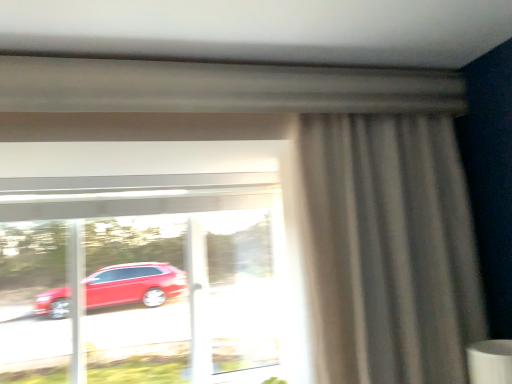
Describe the element at coordinates (390, 248) in the screenshot. I see `matte gray curtain at right` at that location.

Image resolution: width=512 pixels, height=384 pixels. I want to click on matte gray curtain at right, so click(x=390, y=248).

Image resolution: width=512 pixels, height=384 pixels. What do you see at coordinates (147, 264) in the screenshot?
I see `transparent glass window at center` at bounding box center [147, 264].

Find the location of a particular element. This screenshot has height=384, width=512. transparent glass window at center is located at coordinates (147, 264).

Image resolution: width=512 pixels, height=384 pixels. Find the location of `matte gray curtain at right`. matte gray curtain at right is located at coordinates (390, 248).

Considering the relative positions of transparent glass window at center and matte gray curtain at right in the image provided, is transparent glass window at center to the left or to the right of matte gray curtain at right?

Clearly, transparent glass window at center is on the left of matte gray curtain at right in the image.

In the image, is transparent glass window at center positioned in front of or behind matte gray curtain at right?

In the image, transparent glass window at center appears behind matte gray curtain at right.

Does point (170, 147) come behind point (443, 182)?

That is True.

From the image's perspective, which one is positioned lower, transparent glass window at center or matte gray curtain at right?

transparent glass window at center.

From a real-world perspective, which object stands above the other?

matte gray curtain at right is physically above.

Between transparent glass window at center and matte gray curtain at right, which one has larger width?

Wider between the two is matte gray curtain at right.

Does transparent glass window at center have a lesser height compared to matte gray curtain at right?

Yes.

From the picture: Considering the relative sizes of transparent glass window at center and matte gray curtain at right in the image provided, is transparent glass window at center smaller than matte gray curtain at right?

No.

Is transparent glass window at center located outside matte gray curtain at right?

Yes, transparent glass window at center is located beyond the bounds of matte gray curtain at right.

Is the surface of transparent glass window at center in direct contact with matte gray curtain at right?

No.

Does transparent glass window at center turn towards matte gray curtain at right?

Yes, transparent glass window at center is turned towards matte gray curtain at right.

Identify the location of curtain lying on the right of transparent glass window at center. The image size is (512, 384). (390, 248).

Considering the positions of objects matte gray curtain at right and transparent glass window at center in the image provided, who is more to the right, matte gray curtain at right or transparent glass window at center?

From the viewer's perspective, matte gray curtain at right appears more on the right side.

Is the depth of matte gray curtain at right greater than that of transparent glass window at center?

No, matte gray curtain at right is closer to the viewer.

Which point is more forward, (431, 143) or (84, 169)?

The point (431, 143) is in front.

From the image's perspective, which is above, matte gray curtain at right or transparent glass window at center?

From the image's view, matte gray curtain at right is above.

From a real-world perspective, is matte gray curtain at right positioned above or below transparent glass window at center?

matte gray curtain at right is above transparent glass window at center.

Considering the relative sizes of matte gray curtain at right and transparent glass window at center in the image provided, is matte gray curtain at right thinner than transparent glass window at center?

Incorrect, the width of matte gray curtain at right is not less than that of transparent glass window at center.

Is matte gray curtain at right taller than transparent glass window at center?

Indeed, matte gray curtain at right has a greater height compared to transparent glass window at center.

Can you confirm if matte gray curtain at right is smaller than transparent glass window at center?

Yes, matte gray curtain at right is smaller than transparent glass window at center.

Would you say matte gray curtain at right is outside transparent glass window at center?

matte gray curtain at right lies outside transparent glass window at center's area.

Is matte gray curtain at right beside transparent glass window at center?

matte gray curtain at right and transparent glass window at center are not in contact.

Does matte gray curtain at right turn towards transparent glass window at center?

No, matte gray curtain at right is not turned towards transparent glass window at center.

What's the angular difference between matte gray curtain at right and transparent glass window at center's facing directions?

They differ by 0.386 degrees in their facing directions.

Identify the location of window directly beneath the matte gray curtain at right (from a real-world perspective). The width and height of the screenshot is (512, 384). (147, 264).

You are a GUI agent. You are given a task and a screenshot of the screen. Output one action in this format:
    pyautogui.click(x=<x>, y=<y>)
    Task: Click on the window below the matte gray curtain at right (from a real-world perspective)
    
    Given the screenshot: What is the action you would take?
    pyautogui.click(x=147, y=264)

This screenshot has width=512, height=384. In order to click on curtain in front of the transparent glass window at center in this screenshot , I will do `click(390, 248)`.